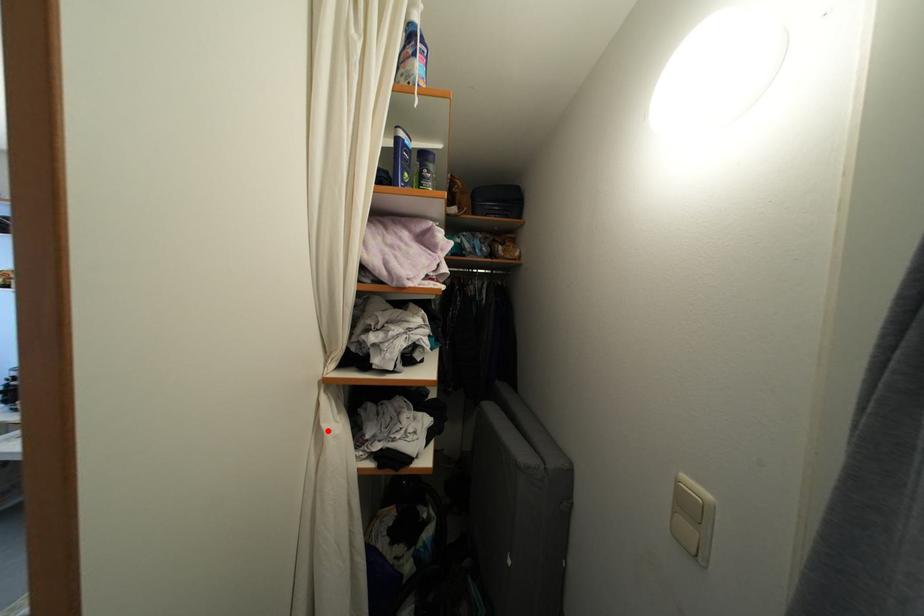
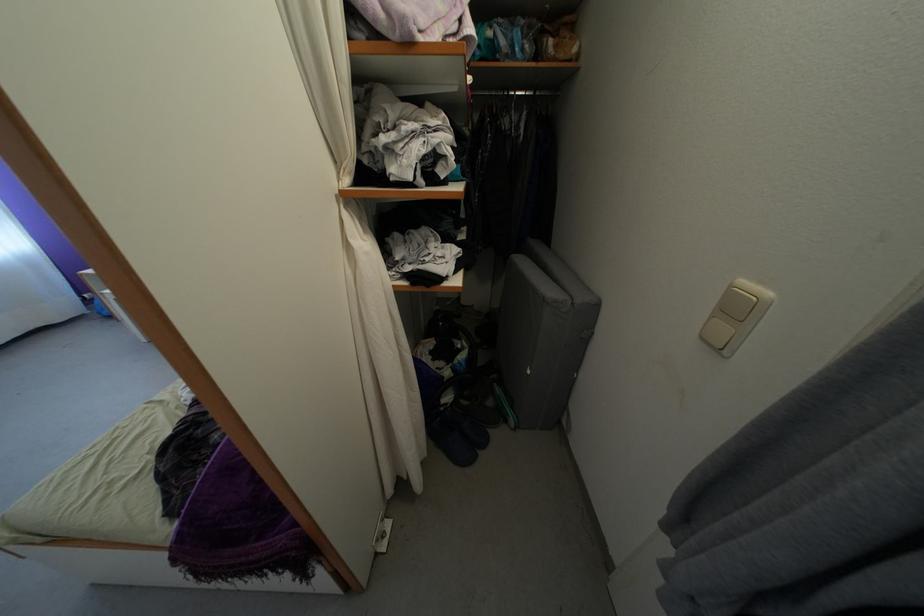
Where in the second image is the point corresponding to the highlighted location from the first image?

(356, 246)